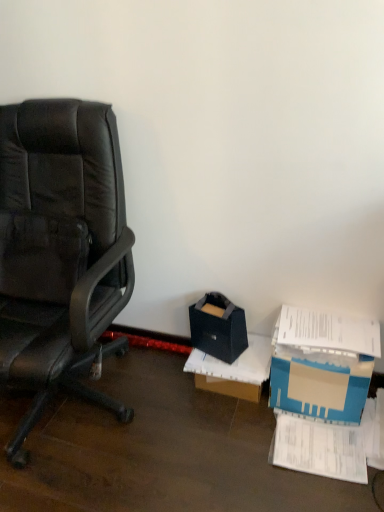
Question: Does white paper at lower right turn towards blue cardboard box at lower right?

Choices:
 (A) yes
 (B) no

Answer: (B)

Question: Is white paper at lower right taller than blue cardboard box at lower right?

Choices:
 (A) yes
 (B) no

Answer: (B)

Question: From the image's perspective, is white paper at lower right under blue cardboard box at lower right?

Choices:
 (A) no
 (B) yes

Answer: (B)

Question: Is the depth of white paper at lower right less than that of blue cardboard box at lower right?

Choices:
 (A) yes
 (B) no

Answer: (A)

Question: Could blue cardboard box at lower right be considered to be inside white paper at lower right?

Choices:
 (A) no
 (B) yes

Answer: (A)

Question: Does white paper at lower right lie behind blue cardboard box at lower right?

Choices:
 (A) no
 (B) yes

Answer: (A)

Question: Can we say white paper at lower right lies outside cardboard box at center?

Choices:
 (A) no
 (B) yes

Answer: (B)

Question: Considering the relative sizes of white paper at lower right and cardboard box at center in the image provided, is white paper at lower right bigger than cardboard box at center?

Choices:
 (A) no
 (B) yes

Answer: (A)

Question: From the image's perspective, does white paper at lower right appear lower than cardboard box at center?

Choices:
 (A) no
 (B) yes

Answer: (B)

Question: Is white paper at lower right placed right next to cardboard box at center?

Choices:
 (A) no
 (B) yes

Answer: (A)

Question: From a real-world perspective, does white paper at lower right sit lower than cardboard box at center?

Choices:
 (A) yes
 (B) no

Answer: (A)

Question: Could you tell me if white paper at lower right is facing cardboard box at center?

Choices:
 (A) no
 (B) yes

Answer: (A)

Question: Is blue cardboard box at lower right facing towards cardboard box at center?

Choices:
 (A) no
 (B) yes

Answer: (A)